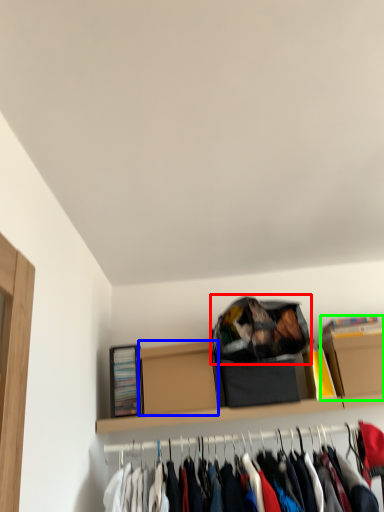
Question: Based on their relative distances, which object is nearer to bag (highlighted by a red box)? Choose from cardboard box (highlighted by a blue box) and cardboard box (highlighted by a green box).

Choices:
 (A) cardboard box
 (B) cardboard box

Answer: (A)